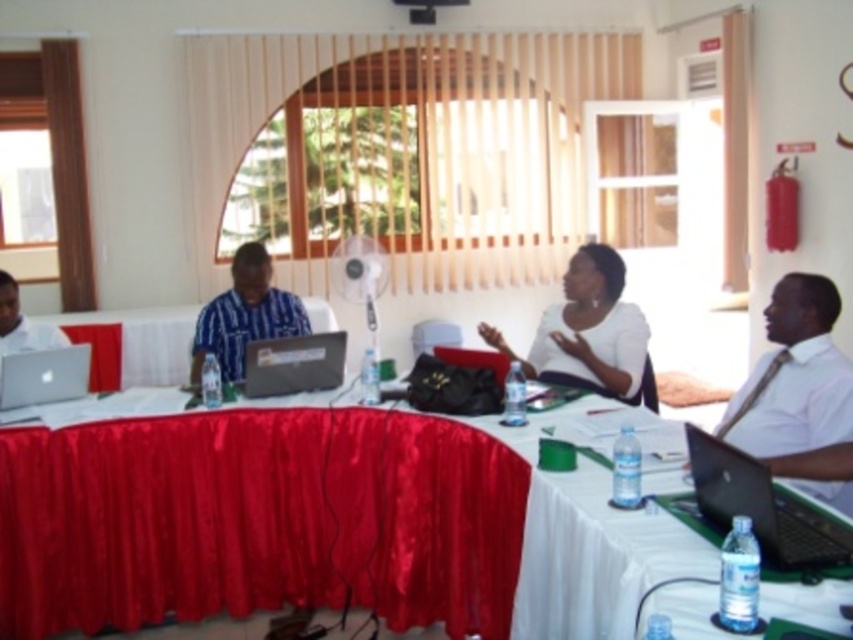
How much distance is there between white shirt at right and silver metallic laptop at center?

A distance of 6.20 feet exists between white shirt at right and silver metallic laptop at center.

Which is in front, point (837, 433) or point (248, 358)?

Point (837, 433) is in front.

Find the location of a particular element. white shirt at right is located at coordinates (799, 392).

Image resolution: width=853 pixels, height=640 pixels. I want to click on white shirt at right, so click(799, 392).

Who is positioned more to the right, white shirt at right or matte silver laptop at left?

Positioned to the right is white shirt at right.

Who is more forward, [840,413] or [16,301]?

Point [840,413]

You are a GUI agent. You are given a task and a screenshot of the screen. Output one action in this format:
    pyautogui.click(x=<x>, y=<y>)
    Task: Click on the white shirt at right
    
    Given the screenshot: What is the action you would take?
    799,392

Where is `white shirt at right`? This screenshot has height=640, width=853. white shirt at right is located at coordinates (799, 392).

Between point (206, 515) and point (50, 326), which one is positioned in front?

Point (206, 515) is in front.

You are a GUI agent. You are given a task and a screenshot of the screen. Output one action in this format:
    pyautogui.click(x=<x>, y=<y>)
    Task: Click on the red satin tablecloth at center
    This screenshot has width=853, height=640.
    Given the screenshot: What is the action you would take?
    pyautogui.click(x=161, y=518)

Is point (370, 422) farther from viewer compared to point (0, 330)?

No, (370, 422) is in front of (0, 330).

I want to click on red satin tablecloth at center, so click(x=161, y=518).